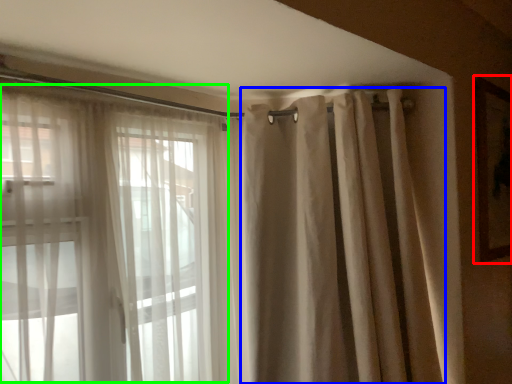
Question: Based on their relative distances, which object is farther from picture frame (highlighted by a red box)? Choose from shower curtain (highlighted by a blue box) and bay window (highlighted by a green box).

Choices:
 (A) shower curtain
 (B) bay window

Answer: (B)